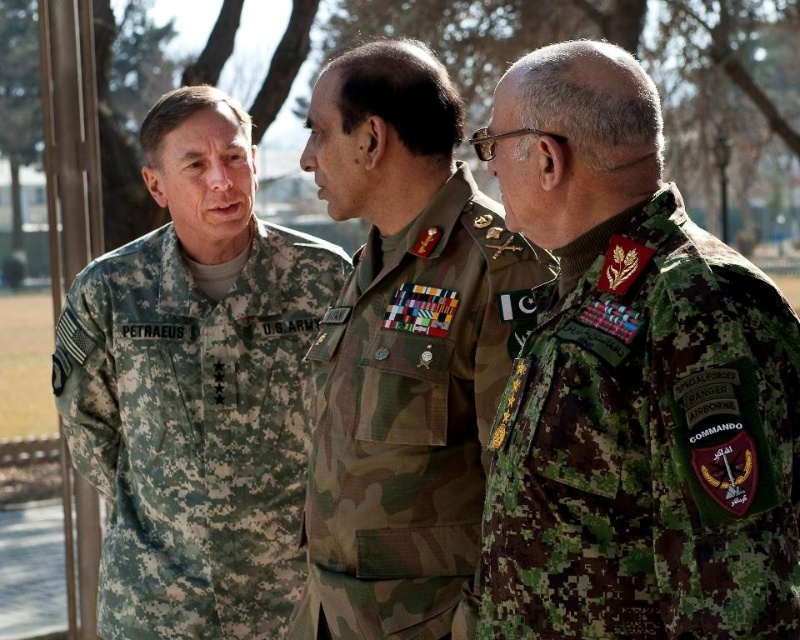
Describe the element at coordinates (648, 445) in the screenshot. The height and width of the screenshot is (640, 800). I see `digital camouflage uniform at right` at that location.

Is digital camouflage uniform at right below camouflage fabric uniform at left?

No.

I want to click on digital camouflage uniform at right, so click(648, 445).

Locate an element on the screen. digital camouflage uniform at right is located at coordinates (648, 445).

Which is above, digital camouflage uniform at right or camouflage fabric military uniform at center?

camouflage fabric military uniform at center

Is point (574, 291) positioned in front of point (401, 620)?

Yes, it is.

Who is more distant from viewer, [521,442] or [332,525]?

Positioned behind is point [332,525].

This screenshot has height=640, width=800. What are the coordinates of `digital camouflage uniform at right` in the screenshot? It's located at (648, 445).

Who is shorter, camouflage fabric uniform at left or camouflage fabric military uniform at center?

With less height is camouflage fabric military uniform at center.

Does camouflage fabric uniform at left have a larger size compared to camouflage fabric military uniform at center?

No.

The width and height of the screenshot is (800, 640). I want to click on camouflage fabric uniform at left, so click(x=194, y=429).

I want to click on camouflage fabric uniform at left, so click(194, 429).